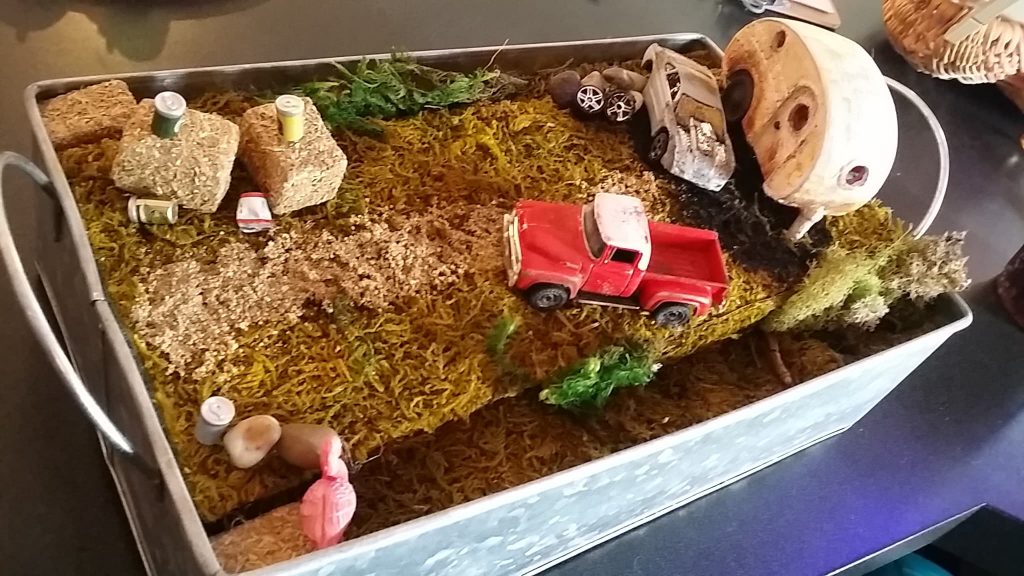
Identify the location of door. (781, 125), (601, 281), (648, 108).